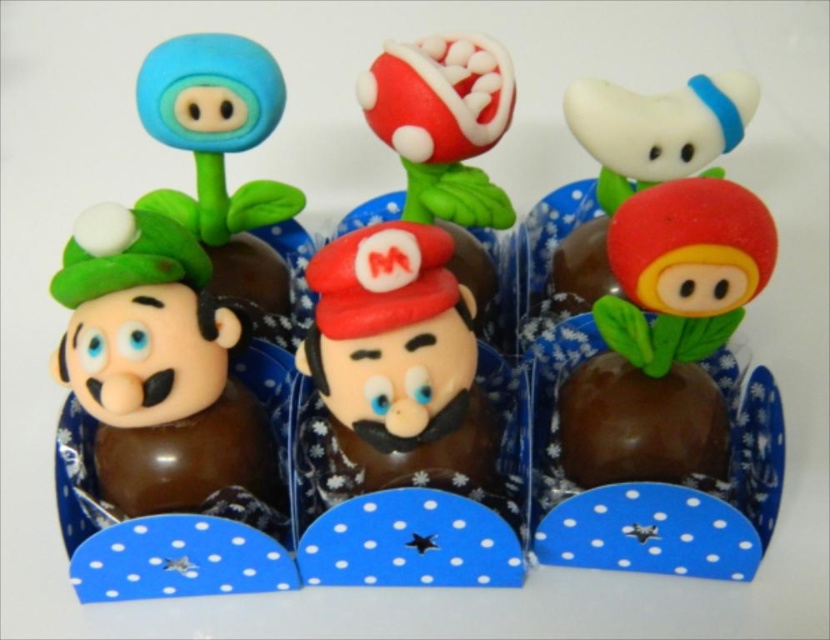
Is matte chocolate luigi at left thinner than matte chocolate mushroom at center?

Incorrect, matte chocolate luigi at left's width is not less than matte chocolate mushroom at center's.

Who is more forward, (169, 419) or (652, 230)?

Point (652, 230) is in front.

Between point (164, 339) and point (589, 442), which one is positioned behind?

Positioned behind is point (589, 442).

This screenshot has width=830, height=640. In order to click on matte chocolate luigi at left in this screenshot , I will do `click(160, 376)`.

In the scene shown: Does matte chocolate luigi at left have a greater height compared to shiny chocolate mushroom at center?

Correct, matte chocolate luigi at left is much taller as shiny chocolate mushroom at center.

Can you confirm if matte chocolate luigi at left is positioned below shiny chocolate mushroom at center?

Actually, matte chocolate luigi at left is above shiny chocolate mushroom at center.

Between point (149, 384) and point (645, 417), which one is positioned behind?

The point (645, 417) is more distant.

Identify the location of matte chocolate luigi at left. (160, 376).

Who is positioned more to the right, white matte mushroom at center or shiny chocolate mushroom at center?

From the viewer's perspective, shiny chocolate mushroom at center appears more on the right side.

Which is behind, point (658, 122) or point (618, 456)?

Point (658, 122)

You are a GUI agent. You are given a task and a screenshot of the screen. Output one action in this format:
    pyautogui.click(x=<x>, y=<y>)
    Task: Click on the white matte mushroom at center
    
    Given the screenshot: What is the action you would take?
    pyautogui.click(x=631, y=172)